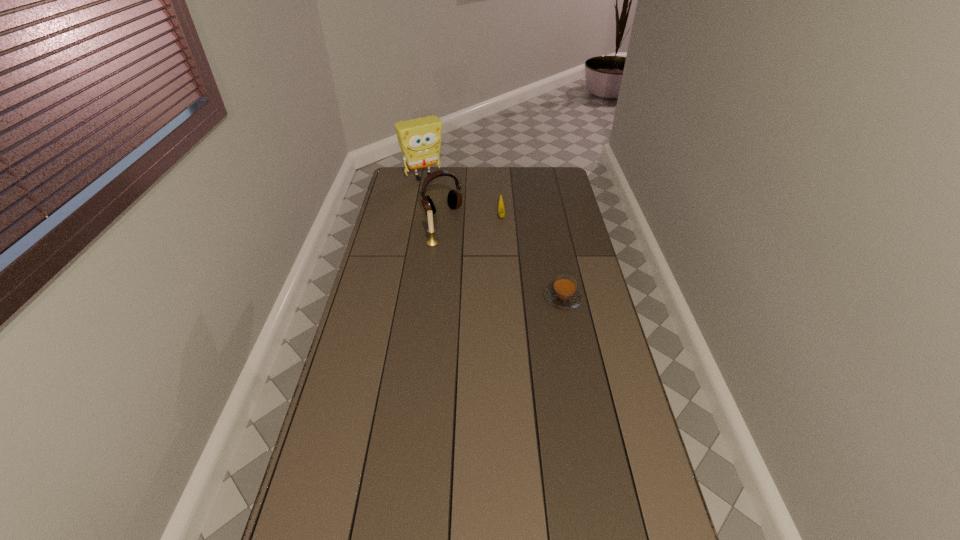
This screenshot has height=540, width=960. I want to click on free spot that satisfies the following two spatial constraints: 1. on the back side of the banana; 2. on the right side of the third tallest object, so click(436, 215).